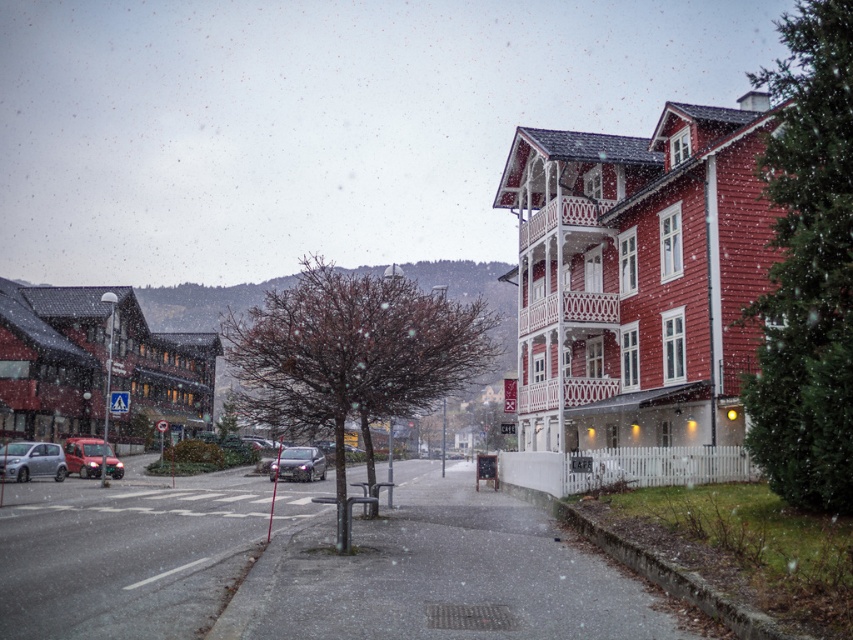
You are standing at the center of the image and want to walk towards the matte red building at left. Which direction should you face to walk directly towards it?

Since the matte red building at left is located at point 0.570 on the x axis and 0.113 on the y axis, you should face towards the left side of the image to walk directly towards it.

You are a delivery driver who needs to park your metallic red van at lower left near the matte red building at left. Based on the scene, can you park the van directly in front of the building?

The matte red building at left is above the metallic red van at lower left, meaning the van is positioned lower down relative to the building. Since the van is already at lower left and the building is above it, the van is likely already parked near the base of the building. Therefore, yes, the metallic red van at lower left is parked directly in front of the matte red building at left.

You are standing in the winter scene and want to walk from the point at coordinates point (115, 474) to the point at coordinates point (309, 458). Will you be moving towards or away from the two story red building with white trim on the right side of the image?

Point (115, 474) is in front of point (309, 458). Since you are moving from a point in front to one behind, you will be moving away from the two story red building with white trim on the right side of the image.